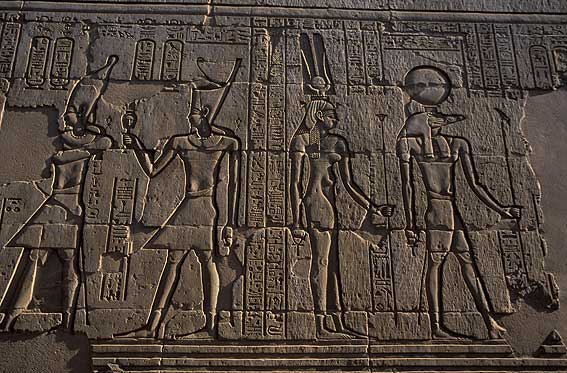
Locate an element on the screen. carved feet is located at coordinates (493, 329), (434, 335), (351, 335), (342, 336), (202, 332), (139, 336).